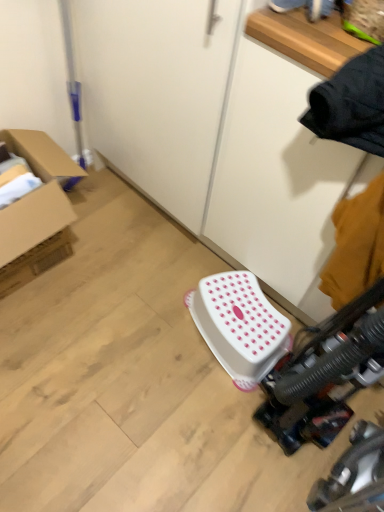
Find the location of a particular element. empty space that is in between cardboard box at left and white plastic stool at center is located at coordinates (142, 293).